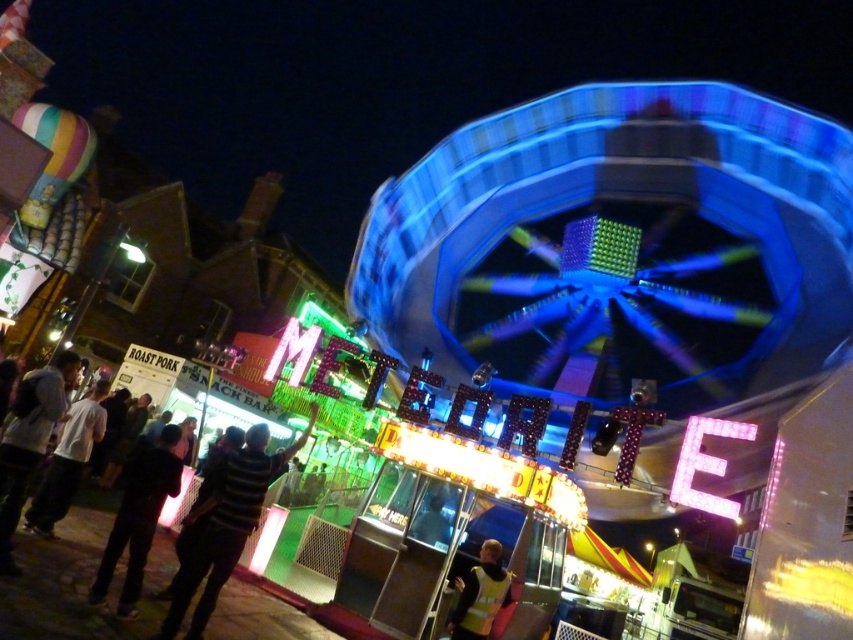
You are standing at the fairground and want to locate the food stall. You see the blue metallic ferris wheel at upper center and the white matte shirt at lower left. Which object is positioned to the right of the other?

The blue metallic ferris wheel at upper center is positioned to the right of the white matte shirt at lower left.